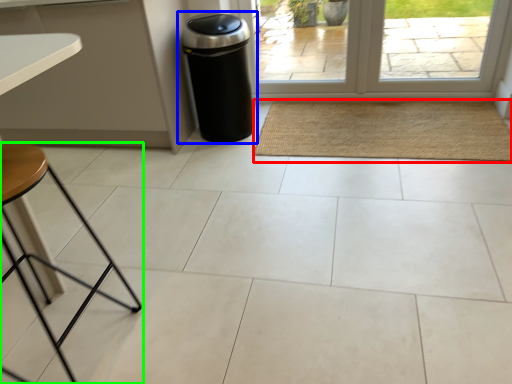
Question: Which object is the closest to the mat (highlighted by a red box)? Choose among these: waste container (highlighted by a blue box) or furniture (highlighted by a green box).

Choices:
 (A) waste container
 (B) furniture

Answer: (A)